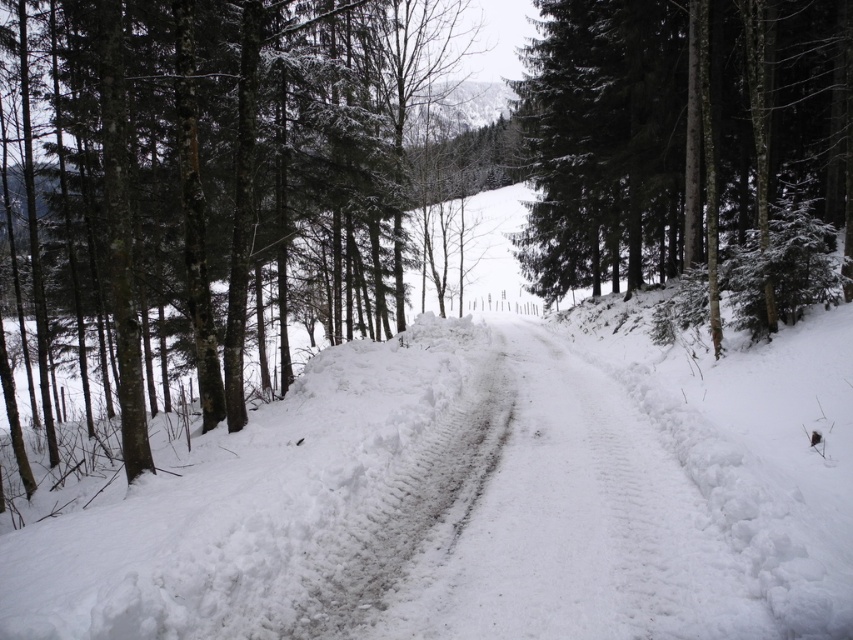
You are an animal trying to cross the snowy forest road. You see the white fluffy snow at center and the green textured tree at center. Which one do you need to avoid stepping on to stay hidden from predators?

The white fluffy snow at center is larger in size than the green textured tree at center, so stepping on the green textured tree at center would create more noise and visibility, making it better to avoid it and stay on the white fluffy snow at center for better concealment.

You are standing on the snowy road and notice the white fluffy snow at center and the green textured tree at center. Which object is positioned to the left of the other?

The white fluffy snow at center is to the left of the green textured tree at center.